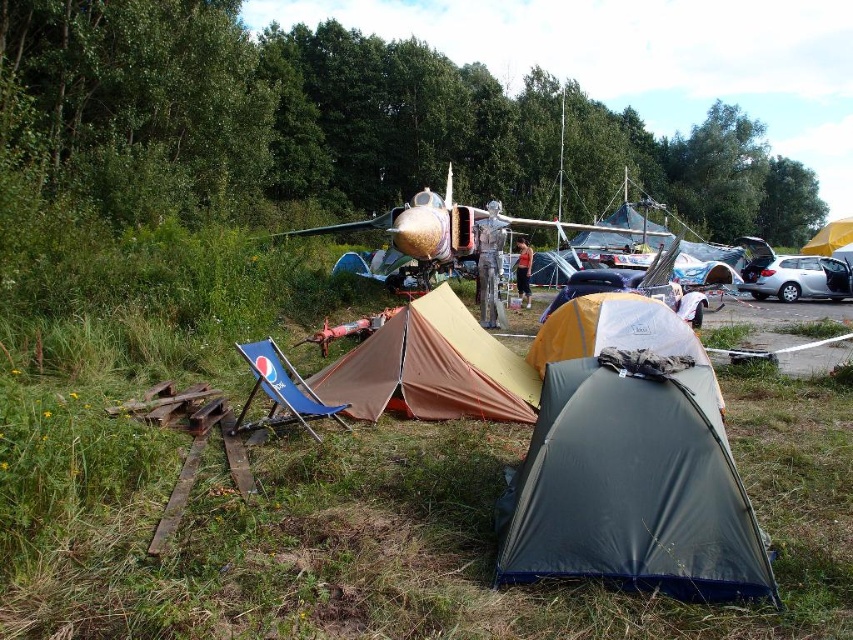
You are a camper who wants to sit on the blue fabric chair at lower center. Is the shiny metallic airplane at center blocking your path to the chair?

The shiny metallic airplane at center is positioned over blue fabric chair at lower center, so it is blocking your path to the chair.

Consider the image. You are standing at the campsite and want to walk from the point labeled as point (759, 257) to the point labeled as point (834, 225). Based on their positions, which direction should you face to move towards your destination?

Since point (759, 257) is in front of point (834, 225), you should face backward to move from point (759, 257) towards point (834, 225).